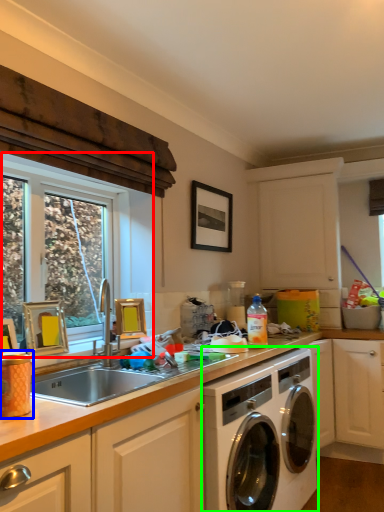
Question: Which object is positioned farthest from window (highlighted by a red box)? Select from appliance (highlighted by a blue box) and washing machine (highlighted by a green box).

Choices:
 (A) appliance
 (B) washing machine

Answer: (A)